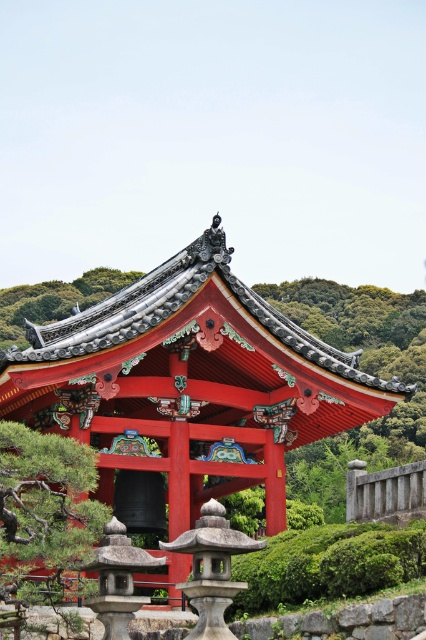
Question: Which object is closer to the camera taking this photo?

Choices:
 (A) green leafy tree at upper left
 (B) green textured pine tree at center

Answer: (B)

Question: Can you confirm if green textured pine tree at center is positioned to the right of green leafy tree at upper left?

Choices:
 (A) no
 (B) yes

Answer: (B)

Question: Can you confirm if green textured pine tree at center is wider than green leafy tree at upper left?

Choices:
 (A) yes
 (B) no

Answer: (B)

Question: Does green textured pine tree at center appear on the right side of green leafy tree at upper left?

Choices:
 (A) yes
 (B) no

Answer: (A)

Question: Which point is closer to the camera taking this photo?

Choices:
 (A) (8, 333)
 (B) (80, 452)

Answer: (B)